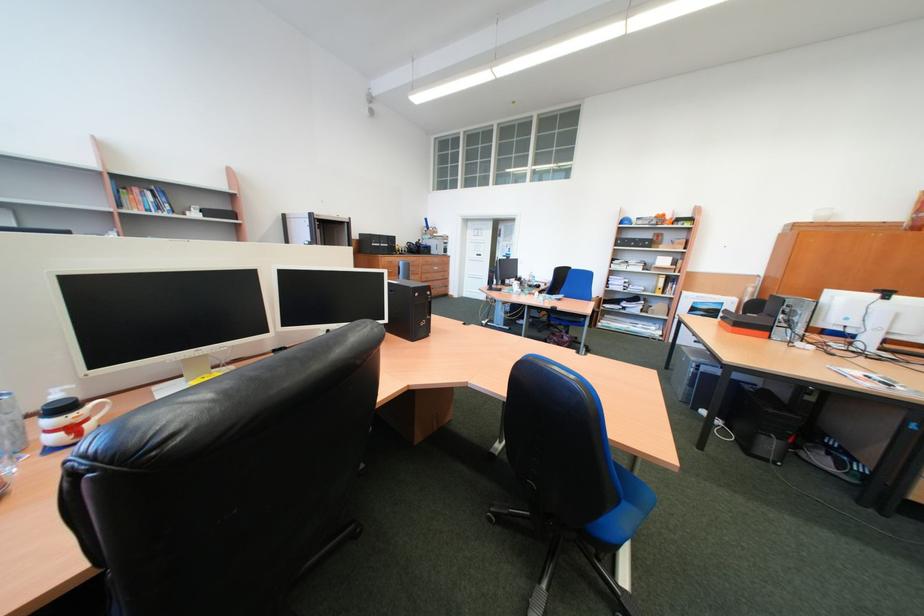
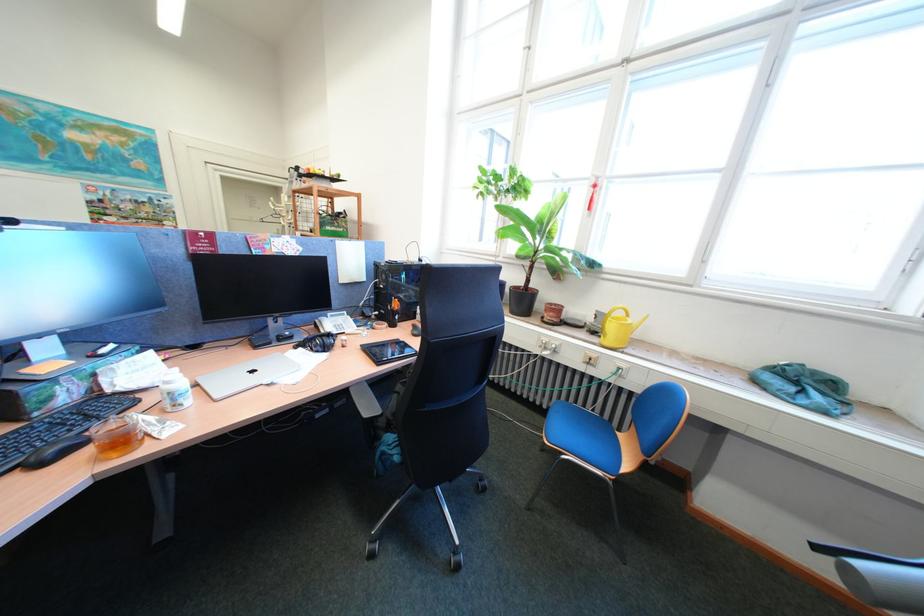
Question: I am providing you with two images of the same scene from different viewpoints. Please identify which objects are invisible in image2.

Choices:
 (A) long pole handle
 (B) snowman mug
 (C) white pill bottle
 (D) yellow watering can

Answer: (B)